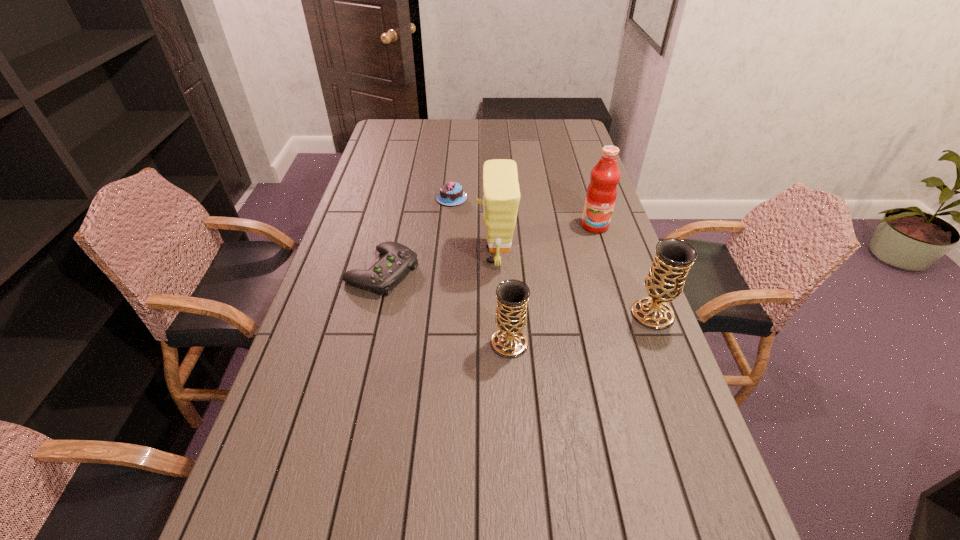
Identify the location of vacant point located on the left of the right chalice. (536, 314).

The height and width of the screenshot is (540, 960). What are the coordinates of `free location located 0.290m on the front of the farthest object` in the screenshot? It's located at (446, 260).

Locate an element on the screen. Image resolution: width=960 pixels, height=540 pixels. vacant space situated on the front label of the fruit juice is located at coordinates (627, 327).

The image size is (960, 540). Find the location of `vacant space located 0.050m on the face of the sponge`. vacant space located 0.050m on the face of the sponge is located at coordinates (461, 255).

This screenshot has height=540, width=960. What are the coordinates of `vacant space situated on the face of the sponge` in the screenshot? It's located at [x=461, y=255].

Where is `free space located on the face of the sponge`? This screenshot has width=960, height=540. free space located on the face of the sponge is located at coordinates (419, 255).

The height and width of the screenshot is (540, 960). Find the location of `vacant region located on the back of the leftmost object`. vacant region located on the back of the leftmost object is located at coordinates (392, 232).

The width and height of the screenshot is (960, 540). Find the location of `object that is at the left edge`. object that is at the left edge is located at coordinates (398, 259).

At what (x,y) coordinates should I click in order to perform the action: click on chalice located in the right edge section of the desktop. Please return your answer as a coordinate pair (x, y). Looking at the image, I should click on (673, 258).

Where is `fruit juice present at the right edge`? The image size is (960, 540). fruit juice present at the right edge is located at coordinates (601, 194).